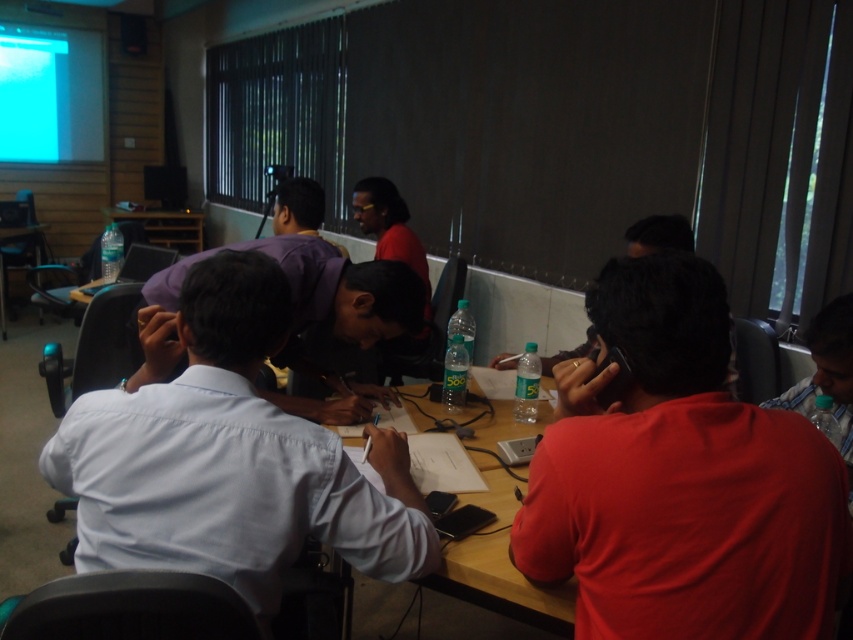
Who is lower down, wooden table at center or wooden table at left?

Positioned lower is wooden table at center.

Does wooden table at center have a greater width compared to wooden table at left?

Yes.

Is point (357, 593) less distant than point (3, 284)?

Yes, point (357, 593) is closer to viewer.

Locate an element on the screen. The height and width of the screenshot is (640, 853). wooden table at center is located at coordinates (498, 561).

Which of these two, red matte shirt at right or wooden table at left, stands shorter?

Standing shorter between the two is red matte shirt at right.

Can you confirm if red matte shirt at right is taller than wooden table at left?

In fact, red matte shirt at right may be shorter than wooden table at left.

Is point (718, 394) closer to viewer compared to point (4, 336)?

That is True.

The image size is (853, 640). Find the location of `red matte shirt at right`. red matte shirt at right is located at coordinates (680, 480).

Between white cotton shirt at center and wooden table at center, which one appears on the right side from the viewer's perspective?

From the viewer's perspective, wooden table at center appears more on the right side.

Between point (430, 560) and point (492, 544), which one is positioned in front?

Positioned in front is point (430, 560).

Which is in front, point (223, 269) or point (550, 602)?

Positioned in front is point (550, 602).

This screenshot has height=640, width=853. Find the location of `white cotton shirt at center`. white cotton shirt at center is located at coordinates (230, 458).